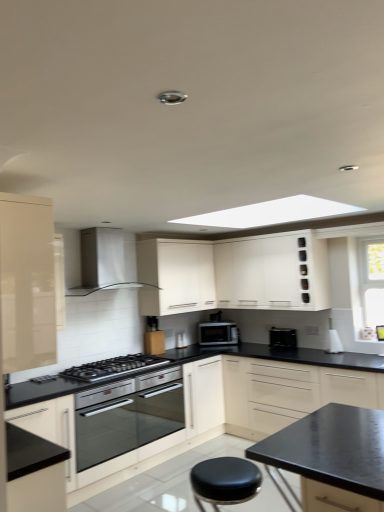
Question: Considering the relative sizes of black leather stool at lower center and satin silver microwave at center in the image provided, is black leather stool at lower center thinner than satin silver microwave at center?

Choices:
 (A) yes
 (B) no

Answer: (B)

Question: From the image's perspective, is black leather stool at lower center under satin silver microwave at center?

Choices:
 (A) yes
 (B) no

Answer: (A)

Question: From a real-world perspective, is black leather stool at lower center under satin silver microwave at center?

Choices:
 (A) no
 (B) yes

Answer: (B)

Question: From a real-world perspective, is black leather stool at lower center located higher than satin silver microwave at center?

Choices:
 (A) no
 (B) yes

Answer: (A)

Question: From the image's perspective, is black leather stool at lower center over satin silver microwave at center?

Choices:
 (A) no
 (B) yes

Answer: (A)

Question: From a real-world perspective, is white matte cabinet at upper center, which is the 3th cabinetry from front to back, physically located above or below satin silver range hood at upper center?

Choices:
 (A) below
 (B) above

Answer: (A)

Question: Is white matte cabinet at upper center, arranged as the second cabinetry when viewed from the back, taller or shorter than satin silver range hood at upper center?

Choices:
 (A) short
 (B) tall

Answer: (B)

Question: Based on their positions, is white matte cabinet at upper center, which is the 3th cabinetry from front to back, located to the left or right of satin silver range hood at upper center?

Choices:
 (A) left
 (B) right

Answer: (B)

Question: Does point (289, 264) appear closer or farther from the camera than point (115, 229)?

Choices:
 (A) farther
 (B) closer

Answer: (A)

Question: Considering the positions of glossy beige cabinet at left, which is the 4th cabinetry in back-to-front order, and stainless steel oven at center in the image, is glossy beige cabinet at left, which is the 4th cabinetry in back-to-front order, taller or shorter than stainless steel oven at center?

Choices:
 (A) short
 (B) tall

Answer: (B)

Question: Is glossy beige cabinet at left, which is counted as the first cabinetry, starting from the front, inside or outside of stainless steel oven at center?

Choices:
 (A) outside
 (B) inside

Answer: (A)

Question: Would you say glossy beige cabinet at left, which is counted as the first cabinetry, starting from the front, is to the left or to the right of stainless steel oven at center in the picture?

Choices:
 (A) right
 (B) left

Answer: (B)

Question: Is glossy beige cabinet at left, which is counted as the first cabinetry, starting from the front, bigger or smaller than stainless steel oven at center?

Choices:
 (A) small
 (B) big

Answer: (A)

Question: Does point (223, 473) appear closer or farther from the camera than point (274, 333)?

Choices:
 (A) farther
 (B) closer

Answer: (B)

Question: In terms of width, does black leather stool at lower center look wider or thinner when compared to black matte toaster at lower center?

Choices:
 (A) wide
 (B) thin

Answer: (A)